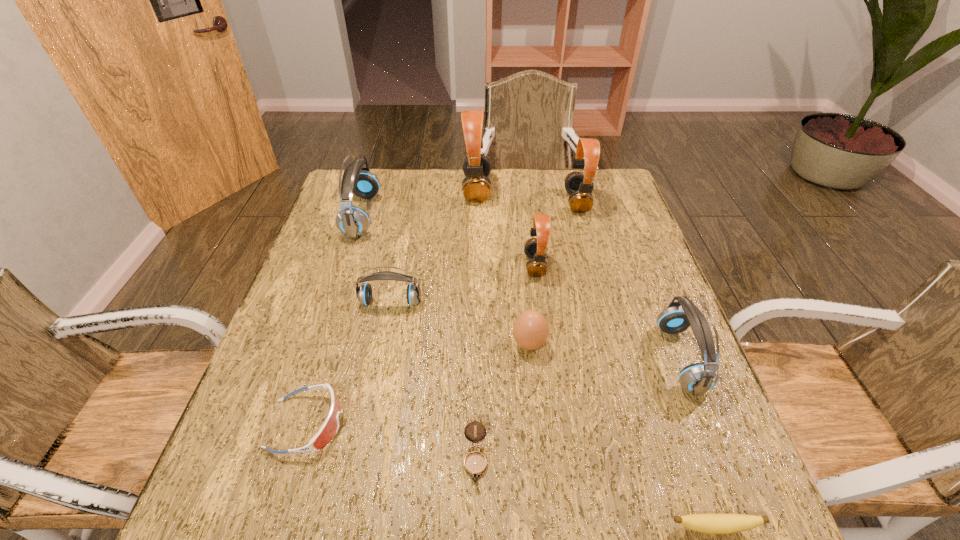
What are the coordinates of `the fifth farthest object` in the screenshot? It's located at (363, 292).

Find the location of `the second nearest blue headset`. the second nearest blue headset is located at coordinates (363, 292).

I want to click on boiled egg, so click(x=530, y=330).

The image size is (960, 540). I want to click on red goggles, so click(329, 429).

Find the location of a particular element. This screenshot has width=960, height=540. compass is located at coordinates (475, 463).

What are the coordinates of `yellow banana` in the screenshot? It's located at (705, 523).

Locate an element on the screen. the shortest object is located at coordinates (705, 523).

Where is `vacant space positioned on the ear cups of the tallest object`? The height and width of the screenshot is (540, 960). vacant space positioned on the ear cups of the tallest object is located at coordinates (577, 189).

Where is `vacant space located 0.280m on the ear cups of the second smallest brown headset`? vacant space located 0.280m on the ear cups of the second smallest brown headset is located at coordinates (475, 202).

Locate an element on the screen. vacant region located 0.130m on the ear cups of the second smallest brown headset is located at coordinates (523, 202).